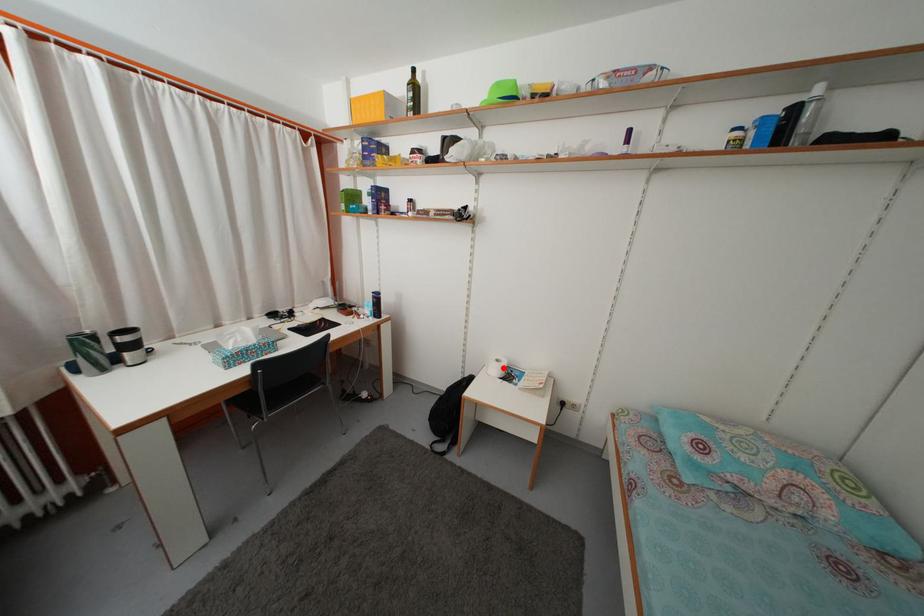
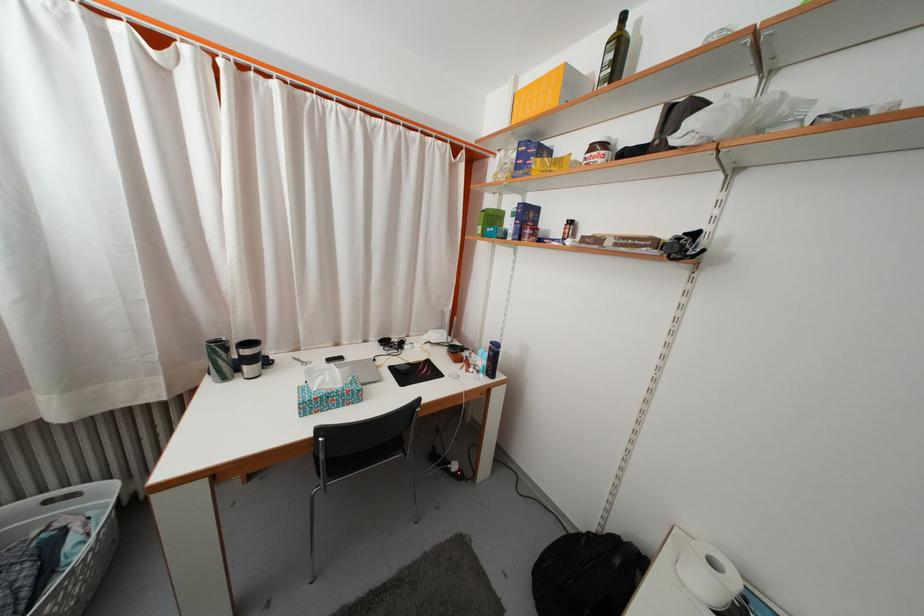
Question: I am providing you with two images of the same scene from different viewpoints. A red point is shown in image1. For the corresponding object point in image2, is it positioned nearer or farther from the camera?

Choices:
 (A) Nearer
 (B) Farther

Answer: (A)